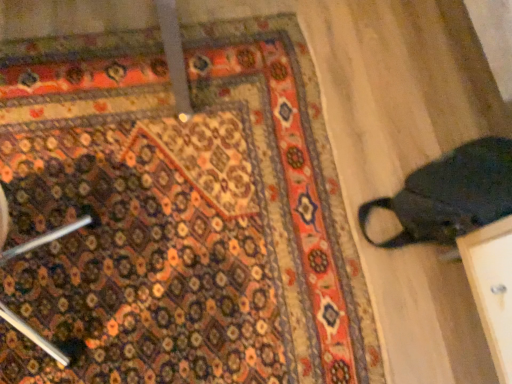
Image resolution: width=512 pixels, height=384 pixels. Find the location of `vacant region in front of dark fabric bag at right`. vacant region in front of dark fabric bag at right is located at coordinates (426, 309).